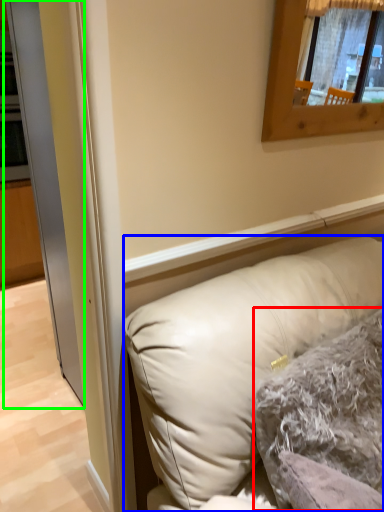
Question: Which is farther away from pillow (highlighted by a red box)? pillow (highlighted by a blue box) or glass door (highlighted by a green box)?

Choices:
 (A) pillow
 (B) glass door

Answer: (B)